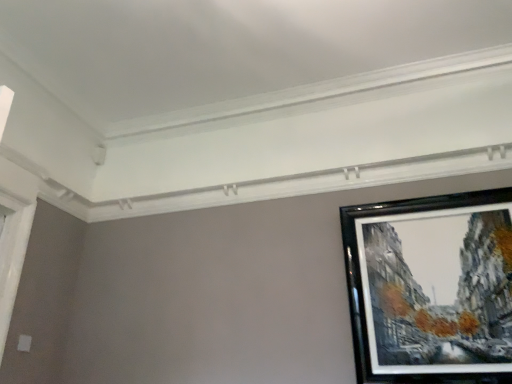
Image resolution: width=512 pixels, height=384 pixels. I want to click on black glossy picture frame at upper right, so click(431, 288).

This screenshot has height=384, width=512. What do you see at coordinates (431, 288) in the screenshot?
I see `black glossy picture frame at upper right` at bounding box center [431, 288].

Identify the location of black glossy picture frame at upper right. (431, 288).